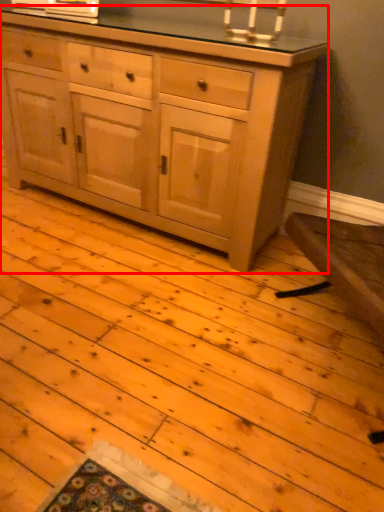
Question: Observing the image, what is the correct spatial positioning of chest of drawers (annotated by the red box) in reference to candle holder?

Choices:
 (A) right
 (B) left

Answer: (B)